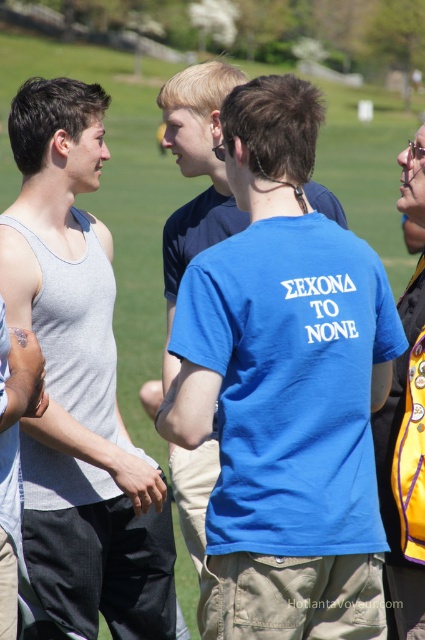
You are a photographer trying to capture a group photo of the gray matte tank top at left and the yellow fabric backpack at right. If you want to ensure both subjects are in focus, which one should you adjust your camera focus closer to?

Since the gray matte tank top at left has a lesser width compared to the yellow fabric backpack at right, you should focus closer to the gray matte tank top at left to ensure both are in focus.

You are standing in a park and see a gray matte tank top at left and a yellow fabric backpack at right. If you want to place a picnic blanket between them, what is the minimum distance the blanket should cover?

The gray matte tank top at left is 5.24 feet from the yellow fabric backpack at right, so the picnic blanket needs to be at least 5.24 feet long to cover the distance between them.

You are standing at the position of the gray matte tank top at left and want to take a photo of a camera that is 6.01 meters away. Is the camera within the standard 50mm lens focal length range for clear photography?

The camera is 6.01 meters away from the gray matte tank top at left. With a 50mm lens, the minimum focusing distance is typically around 0.3 meters, so the camera is well within the focusing range and can be captured clearly.